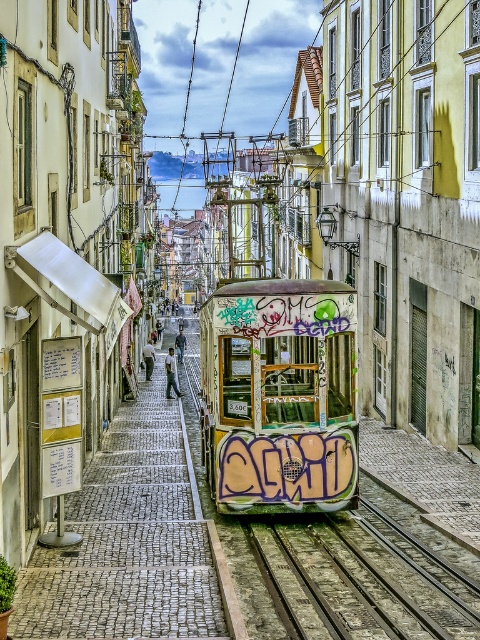
Question: Can you confirm if white paper at center is smaller than rusty metal train track at center?

Choices:
 (A) no
 (B) yes

Answer: (A)

Question: Which of the following is the closest to the observer?

Choices:
 (A) 249,298
 (B) 162,618
 (C) 346,516

Answer: (B)

Question: Can you confirm if white paper at center is positioned above rusty metal train track at center?

Choices:
 (A) no
 (B) yes

Answer: (B)

Question: Is white paper at center positioned before graffiti-covered tram at center?

Choices:
 (A) no
 (B) yes

Answer: (B)

Question: Among these objects, which one is farthest from the camera?

Choices:
 (A) graffiti-covered tram at center
 (B) white paper at center

Answer: (A)

Question: Among these objects, which one is farthest from the camera?

Choices:
 (A) graffiti-covered tram at center
 (B) white paper at center
 (C) rusty metal train track at center

Answer: (A)